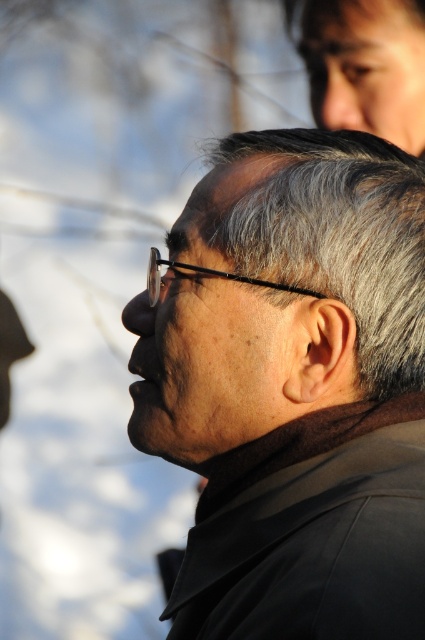
You are a photographer adjusting the focus on your camera. You need to ensure that both the matte black jacket at center and the gray matte hair at center are in focus. Given their sizes, which object should you adjust the focus on first to ensure both are sharp?

The matte black jacket at center is larger in size than gray matte hair at center, so you should focus on the matte black jacket at center first to ensure both are sharp.

You are a photographer adjusting the focus on your camera. You want to ensure that both the matte black jacket at center and the gray matte hair at center are in focus. Given that the depth of field can only sharply focus on one object at a time, which object should you prioritize focusing on to ensure the most important feature of the subject is clear?

The matte black jacket at center has a greater height compared to gray matte hair at center. Therefore, you should prioritize focusing on the matte black jacket at center since it is taller and likely more prominent in the composition, ensuring the subject appears sharp and clear.

You are a photographer adjusting the focus on your camera. You want to ensure both the matte black jacket at center and the gray matte hair at center are in focus. Given that your camera can only focus on objects within a 5 inch range, will both objects be in focus?

The matte black jacket at center is 5.10 inches from gray matte hair at center, which exceeds the camera focus range of 5 inches. Therefore, both objects cannot be in focus simultaneously.